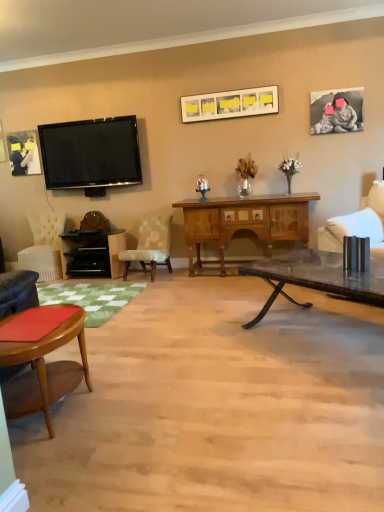
You are a GUI agent. You are given a task and a screenshot of the screen. Output one action in this format:
    pyautogui.click(x=<x>, y=<y>)
    Task: Click on the vacant space situated above wooden oval chair at lower left, arranged as the third chair when viewed from the right (from a real-world perspective)
    This screenshot has width=384, height=512.
    Given the screenshot: What is the action you would take?
    pyautogui.click(x=44, y=320)